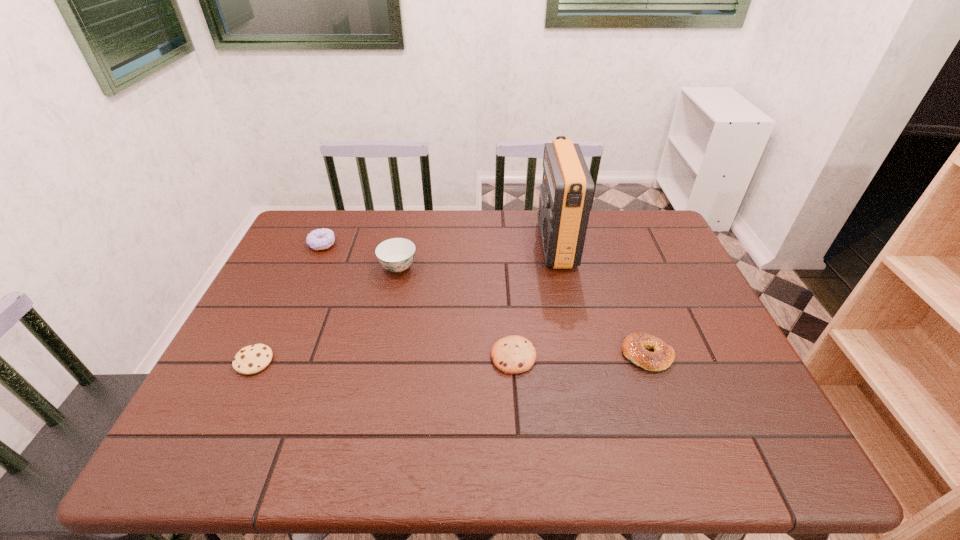
Locate an element on the screen. free space between the left cookie and the fifth object from left to right is located at coordinates (405, 303).

Image resolution: width=960 pixels, height=540 pixels. I want to click on free point between the radio receiver and the left cookie, so click(x=405, y=303).

Find the location of a particular element. The image size is (960, 540). unoccupied area between the right cookie and the third object from left to right is located at coordinates (456, 312).

Where is `vacant area that lies between the left cookie and the doughnut`? vacant area that lies between the left cookie and the doughnut is located at coordinates (288, 303).

At what (x,y) coordinates should I click in order to perform the action: click on free space between the tallest object and the second tallest object. Please return your answer as a coordinate pair (x, y). The image size is (960, 540). Looking at the image, I should click on (477, 255).

Identify the location of free space between the rightmost object and the tallest object. The height and width of the screenshot is (540, 960). (602, 300).

The image size is (960, 540). In order to click on vacant area that lies between the doughnut and the tallest object in this screenshot , I will do pyautogui.click(x=439, y=244).

I want to click on object that is the fifth nearest to the doughnut, so click(634, 347).

Locate which object is the closest to the bagel. Please provide its 2D coordinates. Your answer should be formatted as a tuple, i.e. [(x, y)], where the tuple contains the x and y coordinates of a point satisfying the conditions above.

[(513, 354)]

You are a GUI agent. You are given a task and a screenshot of the screen. Output one action in this format:
    pyautogui.click(x=<x>, y=<y>)
    Task: Click on the free location that satisfies the following two spatial constraints: 1. on the front-facing side of the tallest object; 2. on the front side of the third object from left to right
    
    Given the screenshot: What is the action you would take?
    pyautogui.click(x=561, y=267)